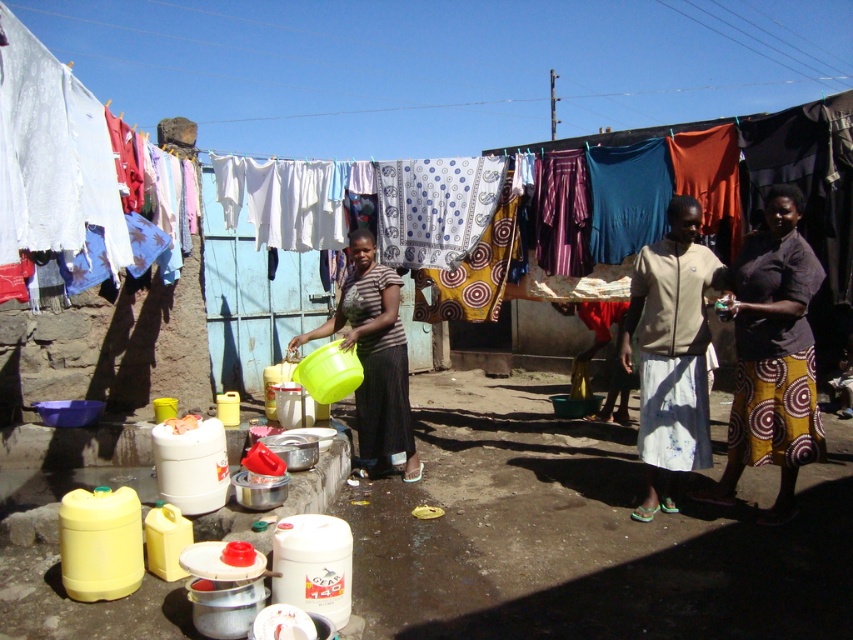
You are hanging laundry and see the beige fabric skirt at center and the matte green plastic bucket at center. Which object is located to the right of the other?

The beige fabric skirt at center is positioned on the right side of matte green plastic bucket at center.

You are hanging laundry and need to reach the yellow printed skirt at right and the matte green plastic bucket at center. Which item is positioned higher?

The yellow printed skirt at right is located above the matte green plastic bucket at center, so it is positioned higher.

You are hanging laundry and notice the yellow printed skirt at right and the matte green plastic bucket at center. Which object has a greater height?

The yellow printed skirt at right is taller than the matte green plastic bucket at center.